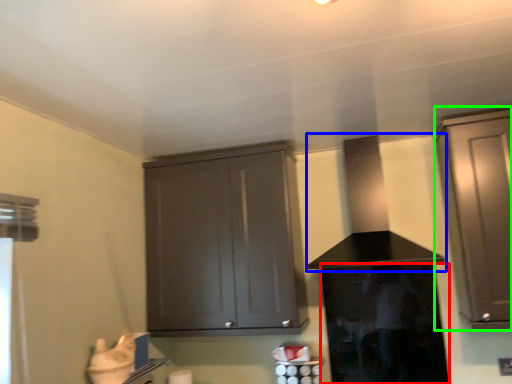
Question: Which is nearer to the screen door (highlighted by a red box)? vent (highlighted by a blue box) or cabinetry (highlighted by a green box).

Choices:
 (A) vent
 (B) cabinetry

Answer: (A)